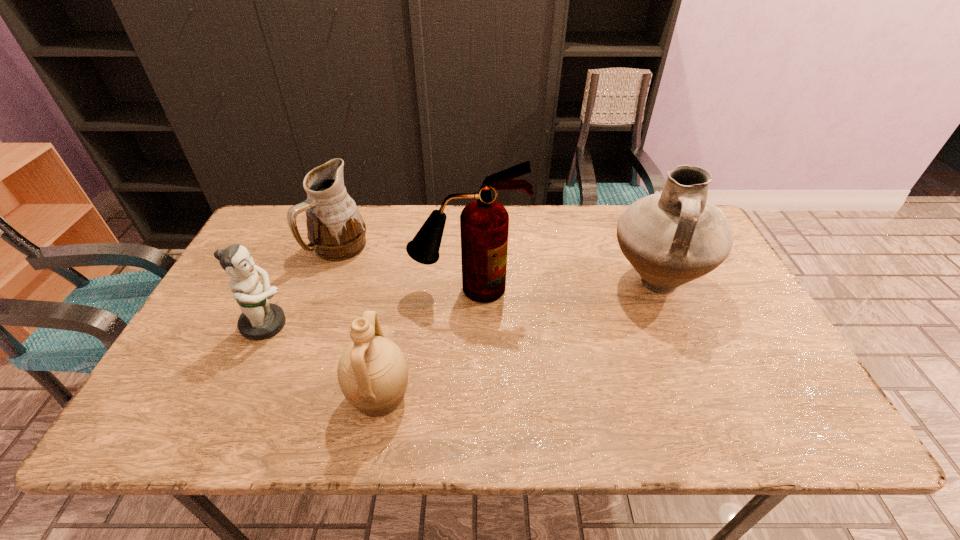
Select which object appears as the closest to the tallest pitcher. Please provide its 2D coordinates. Your answer should be formatted as a tuple, i.e. [(x, y)], where the tuple contains the x and y coordinates of a point satisfying the conditions above.

[(484, 223)]

Identify which pitcher is the nearest to the figurine. Please provide its 2D coordinates. Your answer should be formatted as a tuple, i.e. [(x, y)], where the tuple contains the x and y coordinates of a point satisfying the conditions above.

[(336, 231)]

Identify which pitcher is the closest to the rightmost pitcher. Please provide its 2D coordinates. Your answer should be formatted as a tuple, i.e. [(x, y)], where the tuple contains the x and y coordinates of a point satisfying the conditions above.

[(372, 372)]

Where is `free spot that satisfies the following two spatial constraints: 1. at the nozzle of the fire extinguisher; 2. on the front-facing side of the figurine`? The image size is (960, 540). free spot that satisfies the following two spatial constraints: 1. at the nozzle of the fire extinguisher; 2. on the front-facing side of the figurine is located at coordinates (468, 325).

Image resolution: width=960 pixels, height=540 pixels. Identify the location of vacant space that satisfies the following two spatial constraints: 1. on the front-facing side of the figurine; 2. on the right side of the second pitcher from right to left. (233, 397).

The height and width of the screenshot is (540, 960). In order to click on vacant space that satisfies the following two spatial constraints: 1. on the front-facing side of the nearest object; 2. on the right side of the figurine in this screenshot , I will do `click(233, 397)`.

At what (x,y) coordinates should I click in order to perform the action: click on vacant area in the image that satisfies the following two spatial constraints: 1. at the nozzle of the fire extinguisher; 2. on the front-facing side of the figurine. Please return your answer as a coordinate pair (x, y). The width and height of the screenshot is (960, 540). Looking at the image, I should click on point(468,325).

Find the location of a particular element. free point that satisfies the following two spatial constraints: 1. from the spout of the leftmost pitcher; 2. on the front-facing side of the figurine is located at coordinates (312, 325).